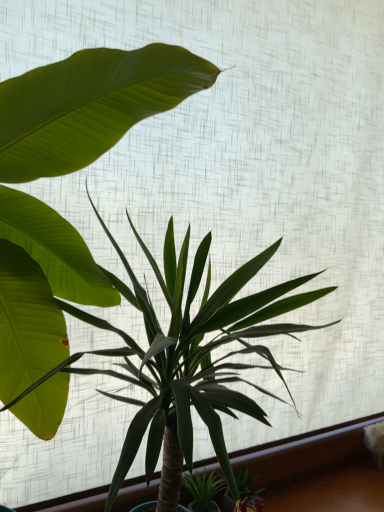
Where is `green leafy plant at center, which appears as the first houseplant when viewed from the left`? The width and height of the screenshot is (384, 512). green leafy plant at center, which appears as the first houseplant when viewed from the left is located at coordinates (89, 105).

This screenshot has width=384, height=512. Describe the element at coordinates (184, 357) in the screenshot. I see `green leafy plant at center, the 1th houseplant from the right` at that location.

What is the approximate height of green leafy plant at lower center?

green leafy plant at lower center is 5.89 inches in height.

The width and height of the screenshot is (384, 512). Identify the location of green leafy plant at center, which appears as the first houseplant when viewed from the left. (89, 105).

Can you tell me how much green leafy plant at center, which is counted as the second houseplant, starting from the left, and green leafy plant at center, which is counted as the second houseplant, starting from the right, differ in facing direction?

The angular difference between green leafy plant at center, which is counted as the second houseplant, starting from the left, and green leafy plant at center, which is counted as the second houseplant, starting from the right, is 0.000182 degrees.

Does green leafy plant at center, the 1th houseplant from the right, have a lesser height compared to green leafy plant at center, which appears as the first houseplant when viewed from the left?

Yes, green leafy plant at center, the 1th houseplant from the right, is shorter than green leafy plant at center, which appears as the first houseplant when viewed from the left.

Would you say green leafy plant at center, which is counted as the second houseplant, starting from the left, is a long distance from green leafy plant at center, which is counted as the second houseplant, starting from the right?

They are positioned close to each other.

Where is `plant behind the green leafy plant at center, the 1th houseplant from the right`? The height and width of the screenshot is (512, 384). plant behind the green leafy plant at center, the 1th houseplant from the right is located at coordinates (248, 487).

From a real-world perspective, is green leafy plant at lower center physically located above or below green leafy plant at center, the 1th houseplant from the right?

From a real-world perspective, green leafy plant at lower center is physically below green leafy plant at center, the 1th houseplant from the right.

Considering the points (254, 500) and (234, 377), which point is behind, point (254, 500) or point (234, 377)?

Point (234, 377)

Is green leafy plant at lower center at the back of green leafy plant at center, which is counted as the second houseplant, starting from the left?

No, green leafy plant at center, which is counted as the second houseplant, starting from the left, is not facing the opposite direction of green leafy plant at lower center.

From the image's perspective, between green leafy plant at center, the 1th houseplant from the right, and green leafy plant at lower center, which one is located above?

green leafy plant at center, the 1th houseplant from the right, appears higher in the image.

You are a GUI agent. You are given a task and a screenshot of the screen. Output one action in this format:
    pyautogui.click(x=<x>, y=<y>)
    Task: Click on the plant below the green leafy plant at center, the 1th houseplant from the right (from the image's perspective)
    Image resolution: width=384 pixels, height=512 pixels.
    Given the screenshot: What is the action you would take?
    pyautogui.click(x=248, y=487)

Is green leafy plant at center, which is counted as the second houseplant, starting from the left, thinner than green leafy plant at lower center?

Incorrect, the width of green leafy plant at center, which is counted as the second houseplant, starting from the left, is not less than that of green leafy plant at lower center.

From a real-world perspective, who is located lower, green leafy plant at lower center or green leafy plant at center, which appears as the first houseplant when viewed from the left?

green leafy plant at lower center, from a real-world perspective.

Is green leafy plant at lower center turned away from green leafy plant at center, which appears as the first houseplant when viewed from the left?

No, green leafy plant at lower center is not facing away from green leafy plant at center, which appears as the first houseplant when viewed from the left.

Is green leafy plant at lower center positioned far away from green leafy plant at center, which is counted as the second houseplant, starting from the right?

They are positioned close to each other.

From the image's perspective, which one is positioned lower, green leafy plant at lower center or green leafy plant at center, which is counted as the second houseplant, starting from the right?

green leafy plant at lower center is shown below in the image.

Is green leafy plant at center, which is counted as the second houseplant, starting from the right, taller than green leafy plant at center, the 1th houseplant from the right?

Correct, green leafy plant at center, which is counted as the second houseplant, starting from the right, is much taller as green leafy plant at center, the 1th houseplant from the right.

In the image, is green leafy plant at center, which is counted as the second houseplant, starting from the right, positioned in front of or behind green leafy plant at center, the 1th houseplant from the right?

green leafy plant at center, which is counted as the second houseplant, starting from the right, is behind green leafy plant at center, the 1th houseplant from the right.

From a real-world perspective, is green leafy plant at center, which is counted as the second houseplant, starting from the right, physically above green leafy plant at center, the 1th houseplant from the right?

Yes, from a real-world perspective, green leafy plant at center, which is counted as the second houseplant, starting from the right, is above green leafy plant at center, the 1th houseplant from the right.

Can you tell me how much green leafy plant at center, which is counted as the second houseplant, starting from the right, and green leafy plant at center, which is counted as the second houseplant, starting from the left, differ in facing direction?

The angular difference between green leafy plant at center, which is counted as the second houseplant, starting from the right, and green leafy plant at center, which is counted as the second houseplant, starting from the left, is 0.000182 degrees.

Does green leafy plant at center, which appears as the first houseplant when viewed from the left, lie in front of green leafy plant at lower center?

Yes, it is in front of green leafy plant at lower center.

From a real-world perspective, between green leafy plant at center, which is counted as the second houseplant, starting from the right, and green leafy plant at lower center, who is vertically lower?

green leafy plant at lower center, from a real-world perspective.

Would you say green leafy plant at center, which is counted as the second houseplant, starting from the right, is outside green leafy plant at lower center?

Absolutely, green leafy plant at center, which is counted as the second houseplant, starting from the right, is external to green leafy plant at lower center.

Which is more to the right, green leafy plant at center, which appears as the first houseplant when viewed from the left, or green leafy plant at lower center?

From the viewer's perspective, green leafy plant at lower center appears more on the right side.

In the image, there is a green leafy plant at center, which is counted as the second houseplant, starting from the right. Where is `houseplant below it (from the image's perspective)`? Image resolution: width=384 pixels, height=512 pixels. houseplant below it (from the image's perspective) is located at coordinates (184, 357).

You are a GUI agent. You are given a task and a screenshot of the screen. Output one action in this format:
    pyautogui.click(x=<x>, y=<y>)
    Task: Click on the 1st houseplant counting from the left side of the green leafy plant at lower center
    
    Given the screenshot: What is the action you would take?
    pyautogui.click(x=184, y=357)

Based on their spatial positions, is green leafy plant at lower center or green leafy plant at center, which appears as the first houseplant when viewed from the left, closer to green leafy plant at center, the 1th houseplant from the right?

green leafy plant at center, which appears as the first houseplant when viewed from the left, is positioned closer to the anchor green leafy plant at center, the 1th houseplant from the right.

Based on their spatial positions, is green leafy plant at lower center or green leafy plant at center, the 1th houseplant from the right, further from green leafy plant at center, which is counted as the second houseplant, starting from the right?

Based on the image, green leafy plant at lower center appears to be further to green leafy plant at center, which is counted as the second houseplant, starting from the right.

Which object lies nearer to the anchor point green leafy plant at center, which is counted as the second houseplant, starting from the left, green leafy plant at center, which is counted as the second houseplant, starting from the right, or green leafy plant at lower center?

green leafy plant at center, which is counted as the second houseplant, starting from the right, is positioned closer to the anchor green leafy plant at center, which is counted as the second houseplant, starting from the left.

In the scene shown: Based on their spatial positions, is green leafy plant at center, which appears as the first houseplant when viewed from the left, or green leafy plant at center, which is counted as the second houseplant, starting from the left, closer to green leafy plant at lower center?

green leafy plant at center, which is counted as the second houseplant, starting from the left.

Considering their positions, is green leafy plant at center, which is counted as the second houseplant, starting from the left, positioned further to green leafy plant at lower center than green leafy plant at center, which is counted as the second houseplant, starting from the right?

green leafy plant at center, which is counted as the second houseplant, starting from the right.

Estimate the real-world distances between objects in this image. Which object is further from green leafy plant at center, which appears as the first houseplant when viewed from the left, green leafy plant at center, which is counted as the second houseplant, starting from the left, or green leafy plant at lower center?

green leafy plant at lower center is positioned further to the anchor green leafy plant at center, which appears as the first houseplant when viewed from the left.

This screenshot has height=512, width=384. I want to click on houseplant located between green leafy plant at center, which is counted as the second houseplant, starting from the left, and green leafy plant at lower center in the depth direction, so click(89, 105).